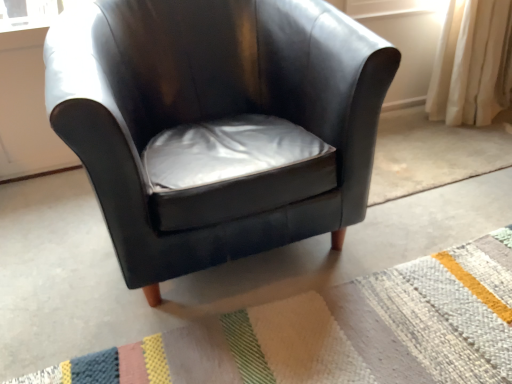
You are a GUI agent. You are given a task and a screenshot of the screen. Output one action in this format:
    pyautogui.click(x=<x>, y=<y>)
    Task: Click on the vacant space that is to the left of matte black armchair at center
    The height and width of the screenshot is (384, 512).
    Given the screenshot: What is the action you would take?
    pyautogui.click(x=50, y=245)